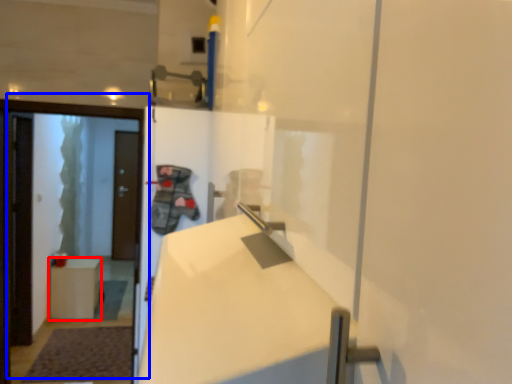
Question: Which object is further to the camera taking this photo, furniture (highlighted by a red box) or door (highlighted by a blue box)?

Choices:
 (A) furniture
 (B) door

Answer: (A)